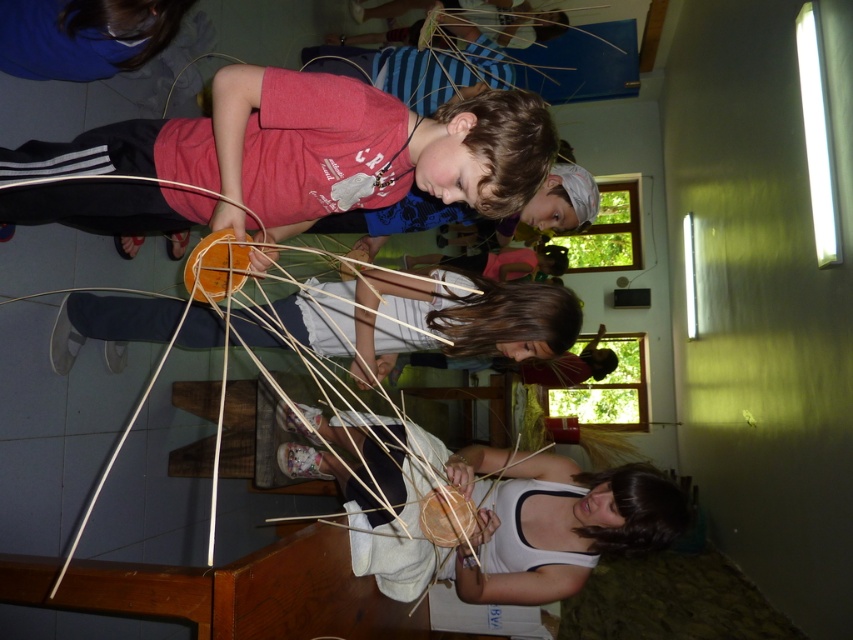
Question: Is natural straw basket at lower center to the right of natural straw basket at center from the viewer's perspective?

Choices:
 (A) yes
 (B) no

Answer: (A)

Question: Which of the following is the farthest from the observer?

Choices:
 (A) (479, 336)
 (B) (585, 563)

Answer: (B)

Question: Does natural straw basket at lower center have a larger size compared to natural straw basket at center?

Choices:
 (A) yes
 (B) no

Answer: (A)

Question: Can you confirm if natural straw basket at lower center is positioned below natural straw basket at center?

Choices:
 (A) yes
 (B) no

Answer: (A)